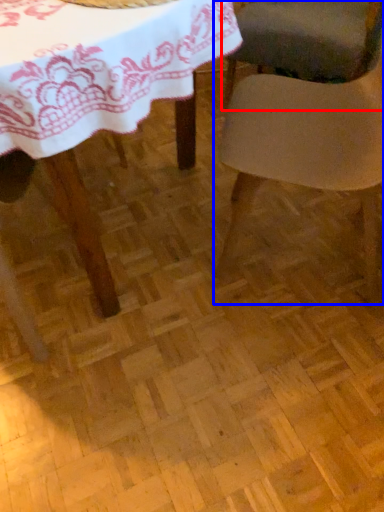
Question: Which point is closer to the camera, chair (highlighted by a red box) or chair (highlighted by a blue box)?

Choices:
 (A) chair
 (B) chair

Answer: (B)